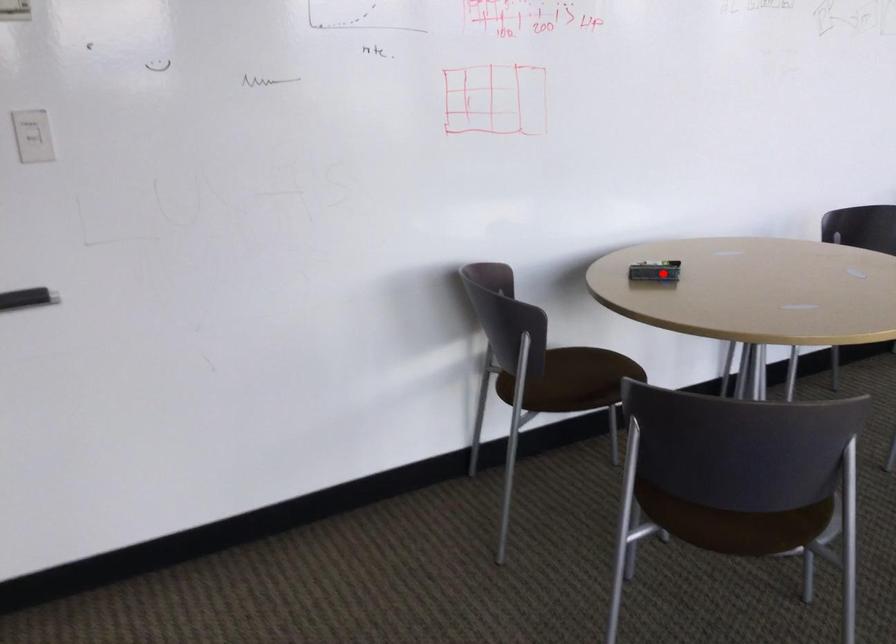
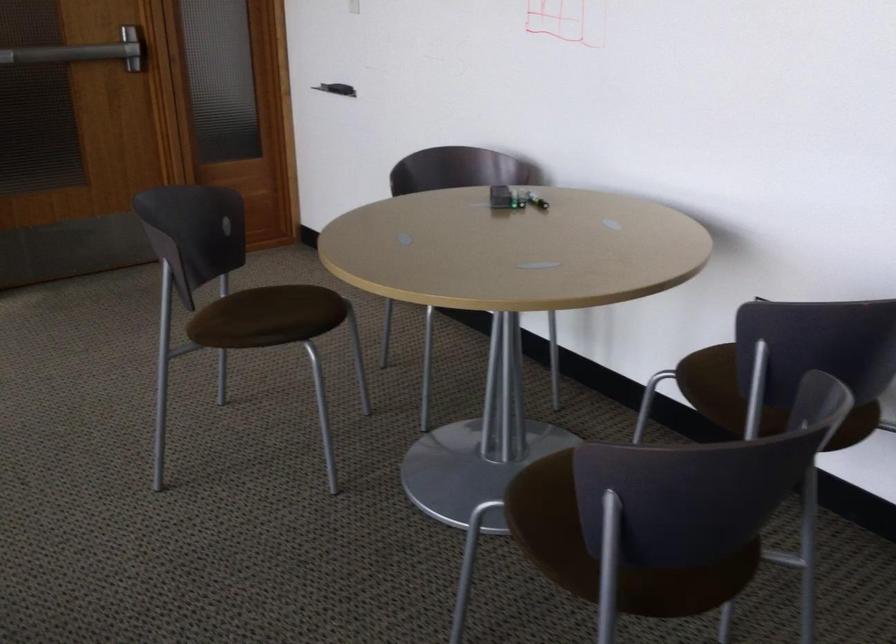
In the second image, find the point that corresponds to the highlighted location in the first image.

(498, 198)